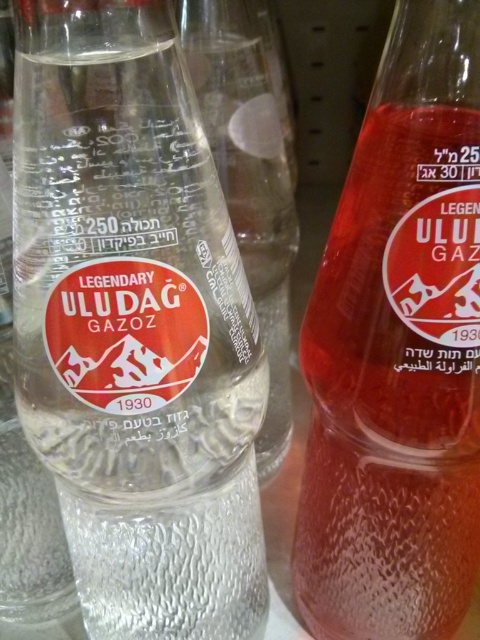
Question: Is clear glass bottle at center positioned in front of translucent glass bottle at center?

Choices:
 (A) no
 (B) yes

Answer: (B)

Question: Which of the following is the farthest from the observer?

Choices:
 (A) (38, 205)
 (B) (379, 198)

Answer: (B)

Question: Observing the image, what is the correct spatial positioning of clear glass bottle at center in reference to translucent glass bottle at center?

Choices:
 (A) above
 (B) below

Answer: (B)

Question: In this image, where is clear glass bottle at center located relative to translucent glass bottle at center?

Choices:
 (A) right
 (B) left

Answer: (B)

Question: Among these points, which one is farthest from the camera?

Choices:
 (A) (450, 196)
 (B) (32, 97)

Answer: (A)

Question: Among these objects, which one is nearest to the camera?

Choices:
 (A) clear glass bottle at center
 (B) translucent glass bottle at center

Answer: (A)